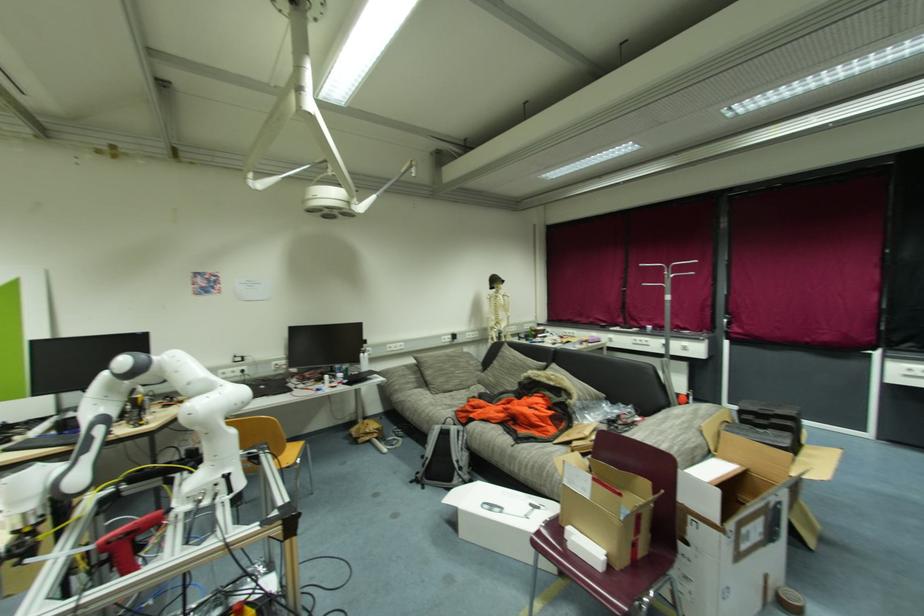
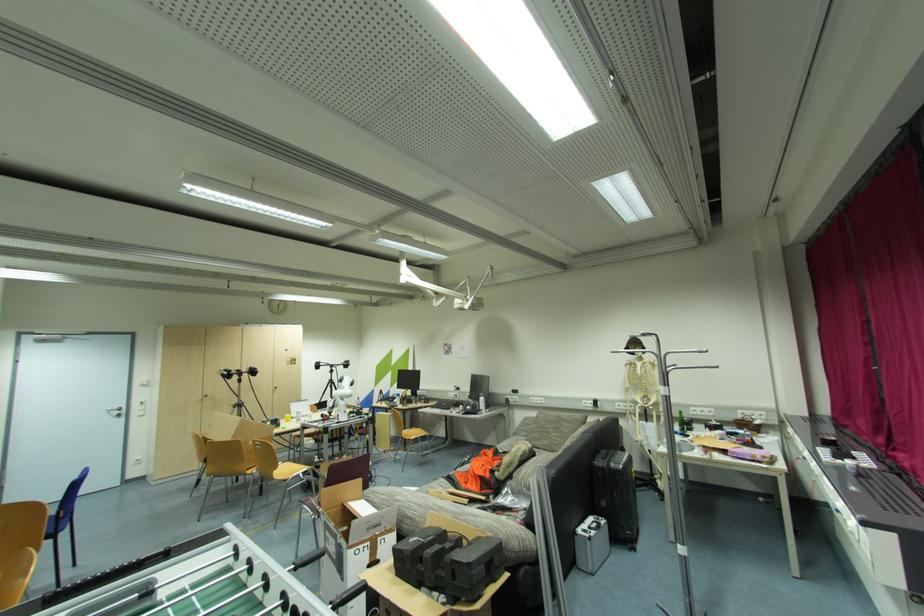
Where in the second image is the point corresponding to pixel 367 357 from the first image?

(484, 400)